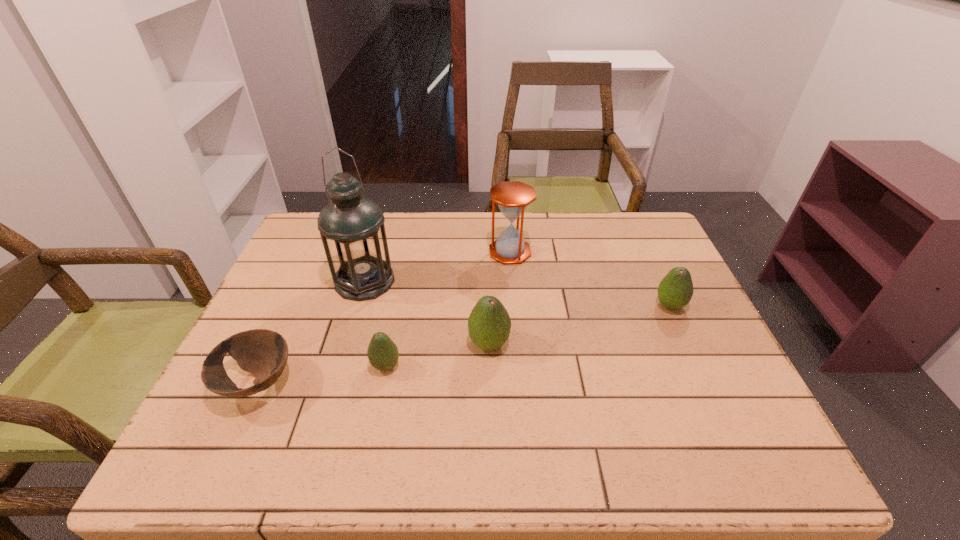
At what (x,y) coordinates should I click in order to perform the action: click on vacant region that satisfies the following two spatial constraints: 1. on the back side of the shortest avocado; 2. on the left side of the hourglass. Please return your answer as a coordinate pair (x, y). The height and width of the screenshot is (540, 960). Looking at the image, I should click on (408, 252).